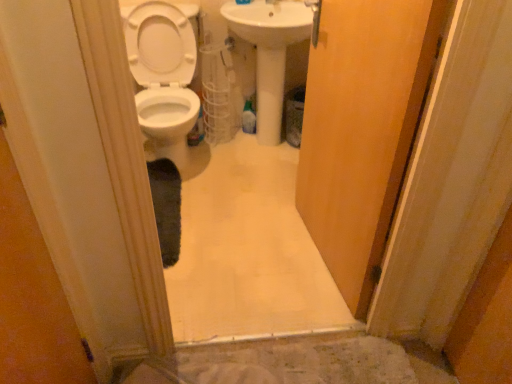
Identify the location of vacant space that's between white glossy toilet at left and wooden door at center. (246, 216).